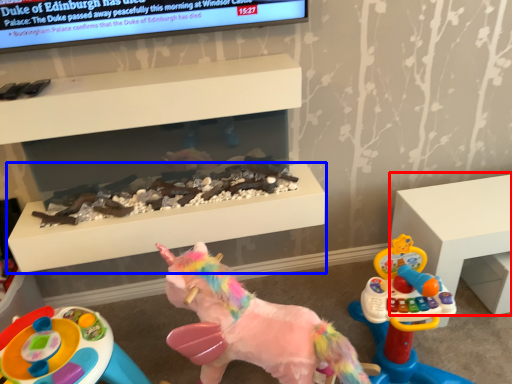
Question: Which of the following is the farthest to the observer, furniture (highlighted by a red box) or table (highlighted by a blue box)?

Choices:
 (A) furniture
 (B) table

Answer: (A)